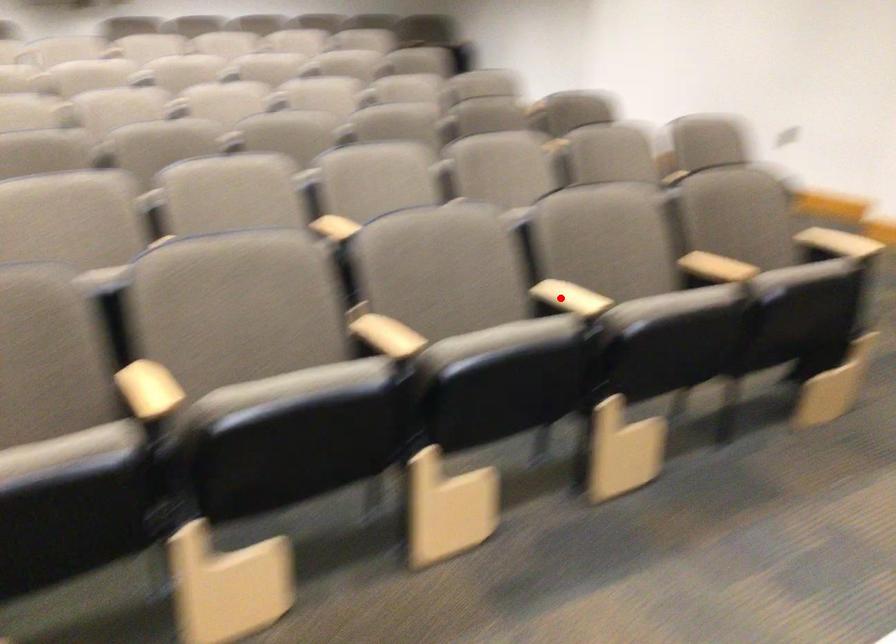
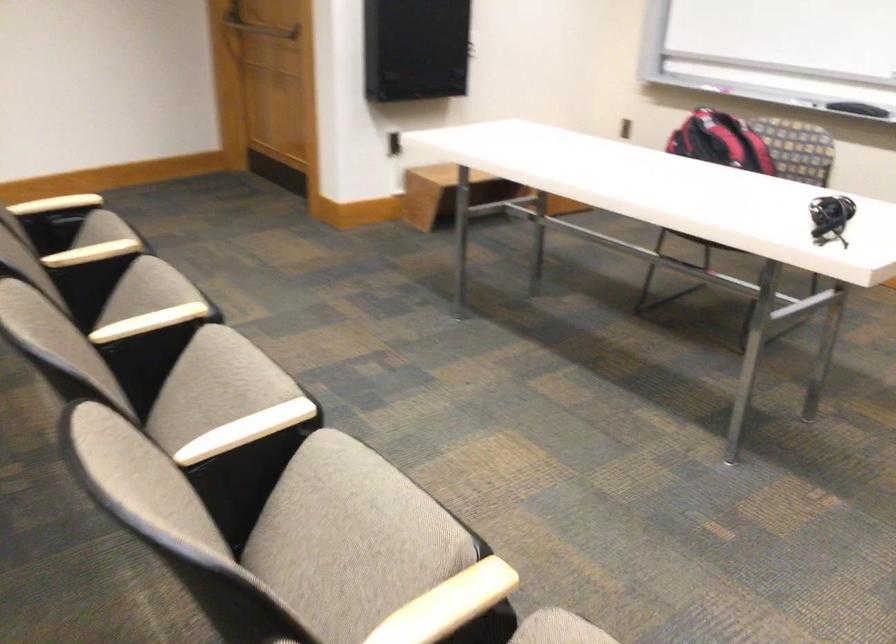
Find the pixel in the second image that matches the highlighted location in the first image.

(149, 322)